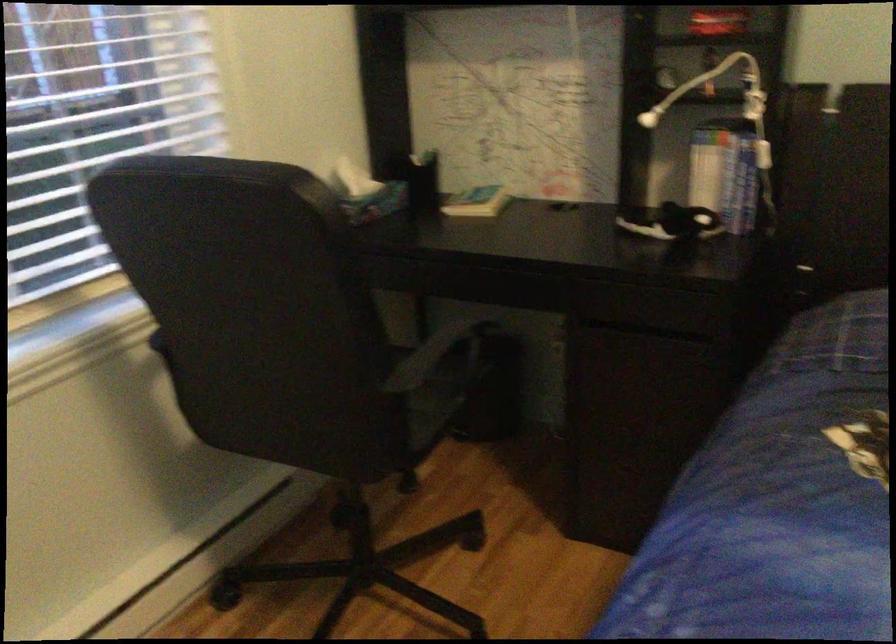
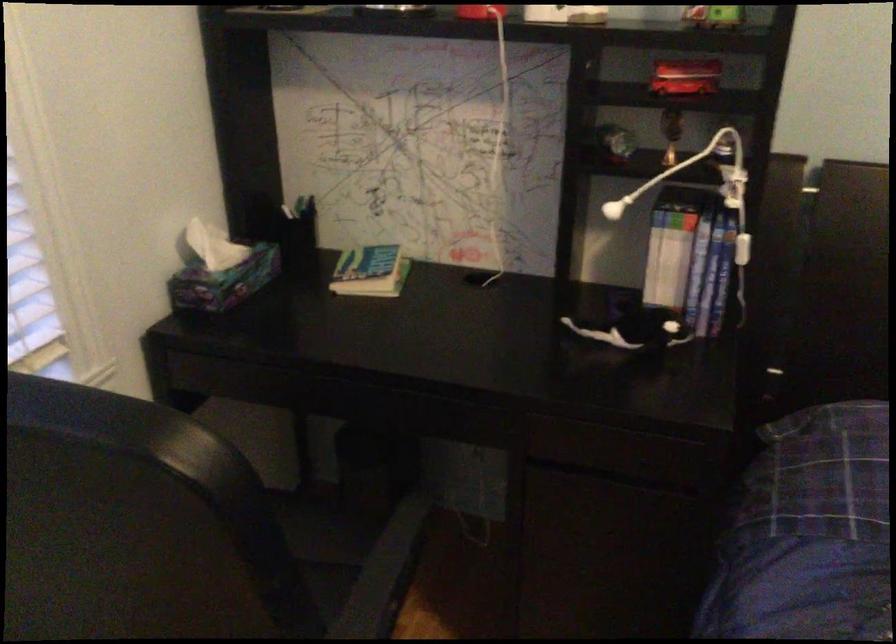
Locate, in the second image, the point that corresponds to the point at 767,153 in the first image.

(742, 249)